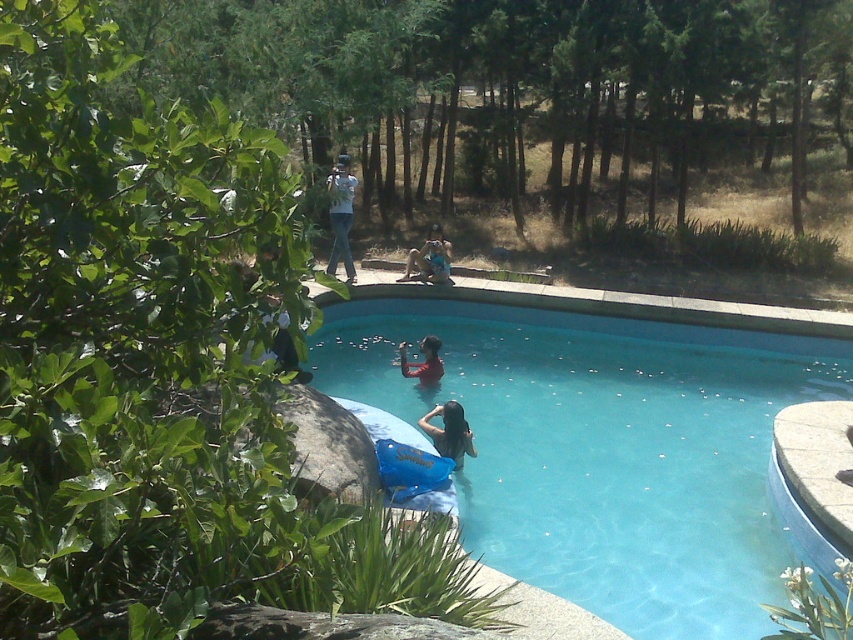
Between white cotton shirt at upper center and blue fabric at center, which one appears on the left side from the viewer's perspective?

white cotton shirt at upper center

Can you confirm if white cotton shirt at upper center is bigger than blue fabric at center?

Yes.

Does point (332, 173) lie in front of point (437, 257)?

No.

I want to click on white cotton shirt at upper center, so click(341, 216).

Which is more to the right, transparent blue water at center or matte red shirt at center?

transparent blue water at center

Is transparent blue water at center shorter than matte red shirt at center?

Yes.

Is point (641, 557) positioned after point (403, 349)?

No, (641, 557) is in front of (403, 349).

Find the location of a particular element. Image resolution: width=853 pixels, height=640 pixels. transparent blue water at center is located at coordinates (602, 442).

Based on the photo, is white cotton shirt at upper center above matte red shirt at center?

Yes, white cotton shirt at upper center is above matte red shirt at center.

What do you see at coordinates (341, 216) in the screenshot?
I see `white cotton shirt at upper center` at bounding box center [341, 216].

What are the coordinates of `white cotton shirt at upper center` in the screenshot? It's located at (341, 216).